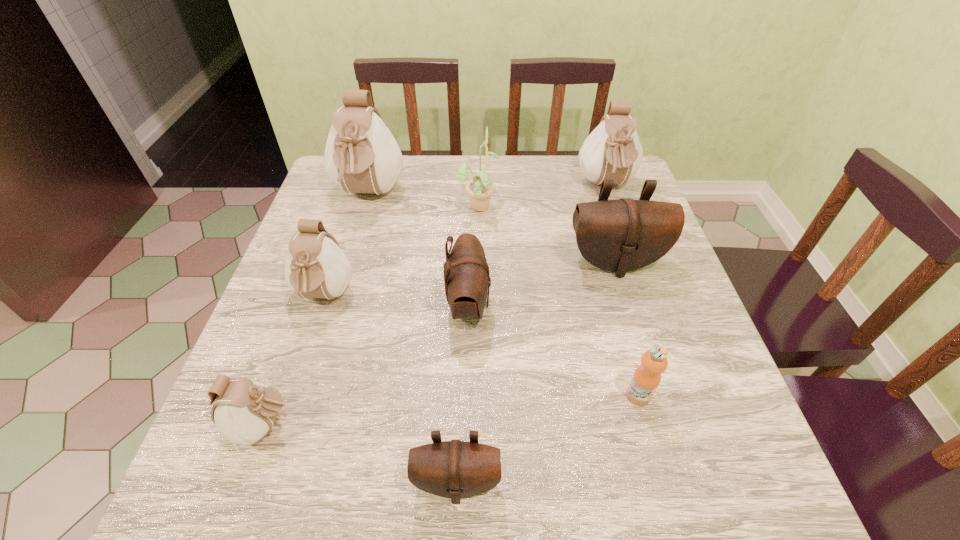
The height and width of the screenshot is (540, 960). What are the coordinates of `object that is at the near edge` in the screenshot? It's located at point(455,469).

Locate an element on the screen. orange juice that is at the right edge is located at coordinates (647, 376).

Find the location of a particular element. The width and height of the screenshot is (960, 540). object located at the far left corner is located at coordinates (361, 155).

Where is `object that is at the far right corner`? This screenshot has width=960, height=540. object that is at the far right corner is located at coordinates (613, 151).

In the image, there is a desktop. Identify the location of vacant space at the far edge. The width and height of the screenshot is (960, 540). (435, 163).

Find the location of a particular element. vacant space at the near edge is located at coordinates (551, 470).

Find the location of a particular element. The image size is (960, 540). free space at the left edge of the desktop is located at coordinates (319, 346).

The height and width of the screenshot is (540, 960). What are the coordinates of `vacant space at the right edge of the desktop` in the screenshot? It's located at (663, 265).

At what (x,y) coordinates should I click in order to perform the action: click on free region at the far left corner of the desktop. Please return your answer as a coordinate pair (x, y). The width and height of the screenshot is (960, 540). Looking at the image, I should click on (347, 198).

Image resolution: width=960 pixels, height=540 pixels. What are the coordinates of `free space at the near left corner` in the screenshot? It's located at (234, 470).